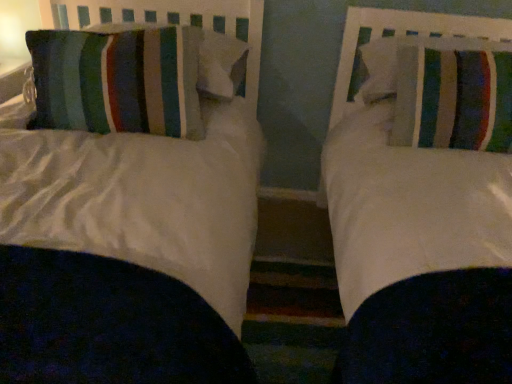
Question: Considering the positions of point (488, 49) and point (243, 74), is point (488, 49) closer or farther from the camera than point (243, 74)?

Choices:
 (A) farther
 (B) closer

Answer: (B)

Question: Relative to striped fabric pillow at left, acting as the 3th pillow starting from the right, is striped fabric pillow at right, which appears as the first pillow when viewed from the right, in front or behind?

Choices:
 (A) front
 (B) behind

Answer: (A)

Question: Which object is positioned farthest from the striped fabric pillow at left, the second pillow when ordered from left to right?

Choices:
 (A) striped fabric pillow at right, the 3th pillow viewed from the left
 (B) striped fabric pillow at left, acting as the 1th pillow starting from the left
 (C) striped fabric pillow at right, which appears as the first pillow when viewed from the right

Answer: (A)

Question: Which is nearer to the striped fabric pillow at right, the second pillow when ordered from right to left?

Choices:
 (A) striped fabric pillow at right, marked as the 4th pillow in a left-to-right arrangement
 (B) striped fabric pillow at left, acting as the 3th pillow starting from the right
 (C) striped fabric pillow at left, the fourth pillow when ordered from right to left

Answer: (A)